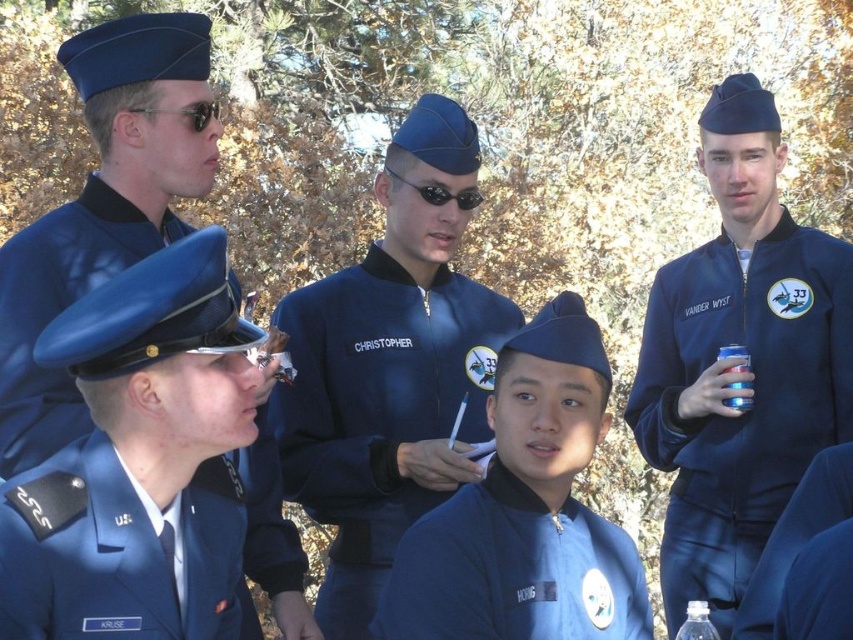
You are a tailor who needs to determine which item requires more fabric for alterations. Based on the image, which object is thinner between the blue matte jacket at upper right and the matte blue uniform at center?

The blue matte jacket at upper right is thinner than the matte blue uniform at center, so it would require less fabric for alterations compared to the thicker uniform.

You are a tailor who needs to determine which uniform requires more fabric to make between the blue matte jacket at upper right and the matte blue uniform at center. Which one would need more fabric?

The blue matte jacket at upper right is bigger than the matte blue uniform at center, so it would require more fabric to make.